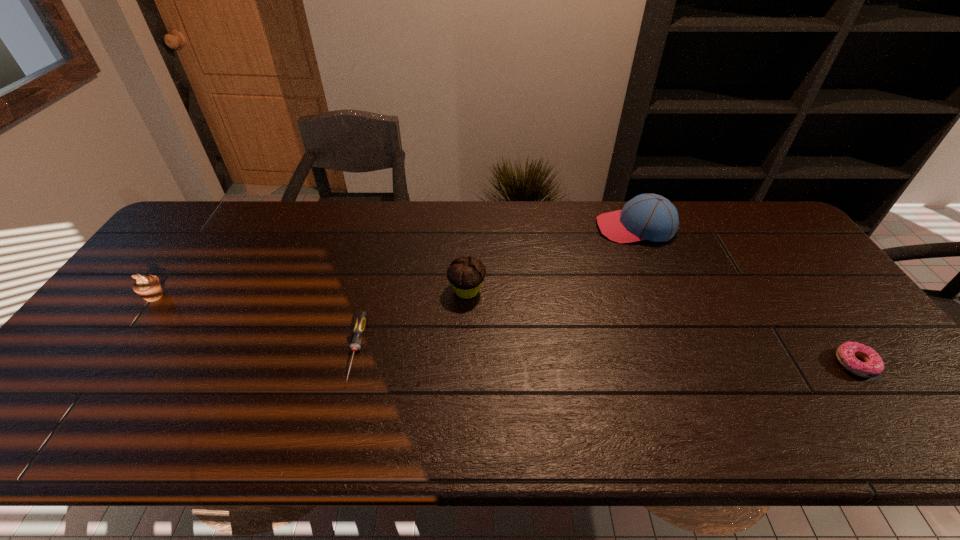
Find the location of a particular element. vacant space at the near edge of the desktop is located at coordinates (144, 417).

Image resolution: width=960 pixels, height=540 pixels. In the image, there is a desktop. In order to click on vacant region at the right edge in this screenshot , I will do `click(792, 260)`.

The height and width of the screenshot is (540, 960). Find the location of `vacant space at the far right corner`. vacant space at the far right corner is located at coordinates (751, 233).

Image resolution: width=960 pixels, height=540 pixels. I want to click on free spot between the leftmost object and the fourth object from left to right, so click(x=395, y=262).

This screenshot has width=960, height=540. Find the location of `vacant area that lies between the baseball cap and the leftmost object`. vacant area that lies between the baseball cap and the leftmost object is located at coordinates 395,262.

The width and height of the screenshot is (960, 540). What are the coordinates of `vacant space in between the screwdriver and the second shortest object` in the screenshot? It's located at (606, 357).

At what (x,y) coordinates should I click in order to perform the action: click on free space between the screwdriver and the doughnut. Please return your answer as a coordinate pair (x, y). The image size is (960, 540). Looking at the image, I should click on (606, 357).

Where is `free space that is in between the second object from left to right and the second object from right to left`? This screenshot has width=960, height=540. free space that is in between the second object from left to right and the second object from right to left is located at coordinates (496, 289).

The image size is (960, 540). Find the location of `free space between the fourth object from right to left and the second shortest object`. free space between the fourth object from right to left and the second shortest object is located at coordinates (606, 357).

Identify the location of empty space that is in between the screwdriver and the right muffin. (412, 320).